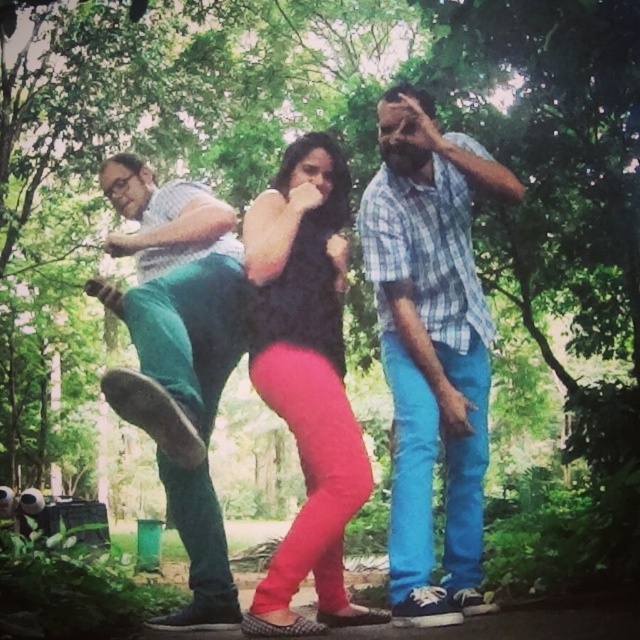
You are a photographer trying to capture the scene. You want to ensure the blue plaid shirt at center and the black matte dress at center are both in focus. Which object should you position the camera focus on first to ensure both are sharp?

The blue plaid shirt at center is to the right of black matte dress at center. To ensure both are in focus, you should position the camera focus on the black matte dress at center first, as it is closer to the camera, and then adjust to include the blue plaid shirt at center in the focal plane.

You are a photographer setting up a camera to capture the scene described. You need to ensure that both the black matte dress at center and the matte green pants at left are in focus. Given that your camera can only focus on objects within a 12 inch range, will both subjects be in focus?

The black matte dress at center is 13.22 inches from the matte green pants at left, which exceeds the camera focus range of 12 inches. Therefore, both subjects cannot be in focus simultaneously.